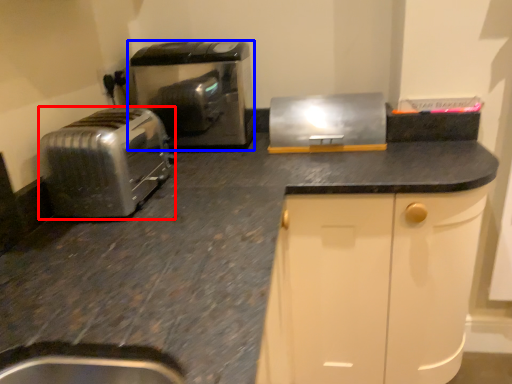
Question: Which object appears closest to the camera in this image, toaster (highlighted by a red box) or home appliance (highlighted by a blue box)?

Choices:
 (A) toaster
 (B) home appliance

Answer: (A)